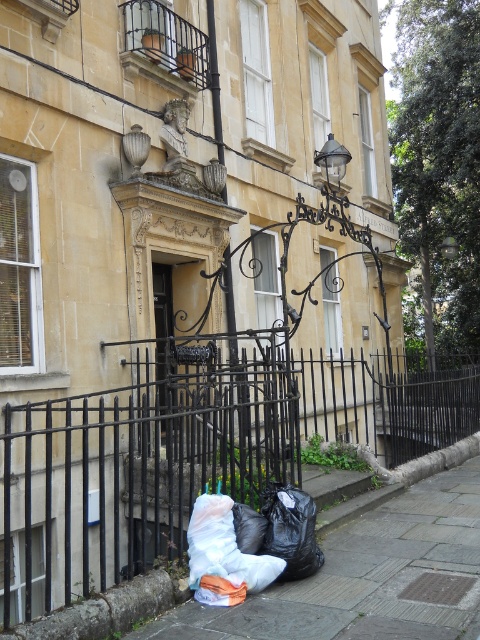
In the scene shown: You are a delivery person who needs to place a new package on the ground near the ALFRED STREET gate. You have two options for placing the package next to existing items. Which item, the black plastic bags at lower center or the white plastic bag at lower center, should you choose if you want to place the package on the ground level without stacking?

You should place the package next to the white plastic bag at lower center because it is taller than the black plastic bags at lower center, allowing for better visibility and easier access at ground level.

You are a delivery person holding a package that measures 16 inches in length. You need to place it between the black plastic bags at lower center and the white plastic bag at lower center. Will the package fit in the space between them?

The distance between the black plastic bags at lower center and the white plastic bag at lower center is 15.87 inches. Since the package is 16 inches long, it will not fit in the available space between them.